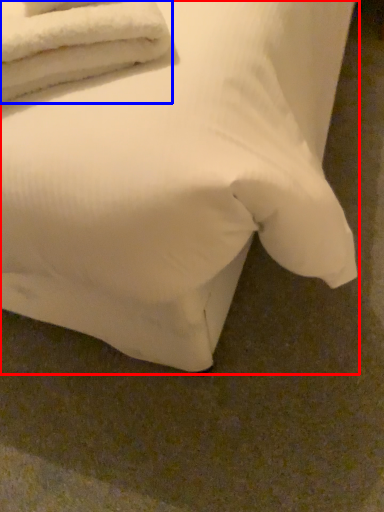
Question: Which object appears farthest to the camera in this image, bed (highlighted by a red box) or towel (highlighted by a blue box)?

Choices:
 (A) bed
 (B) towel

Answer: (B)